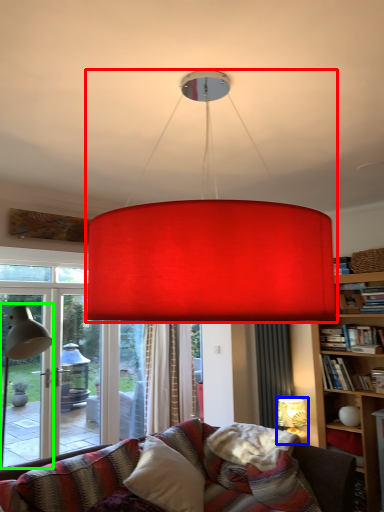
Question: Based on their relative distances, which object is farther from lamp (highlighted by a red box)? Choose from lamp (highlighted by a blue box) and table lamp (highlighted by a green box).

Choices:
 (A) lamp
 (B) table lamp

Answer: (A)